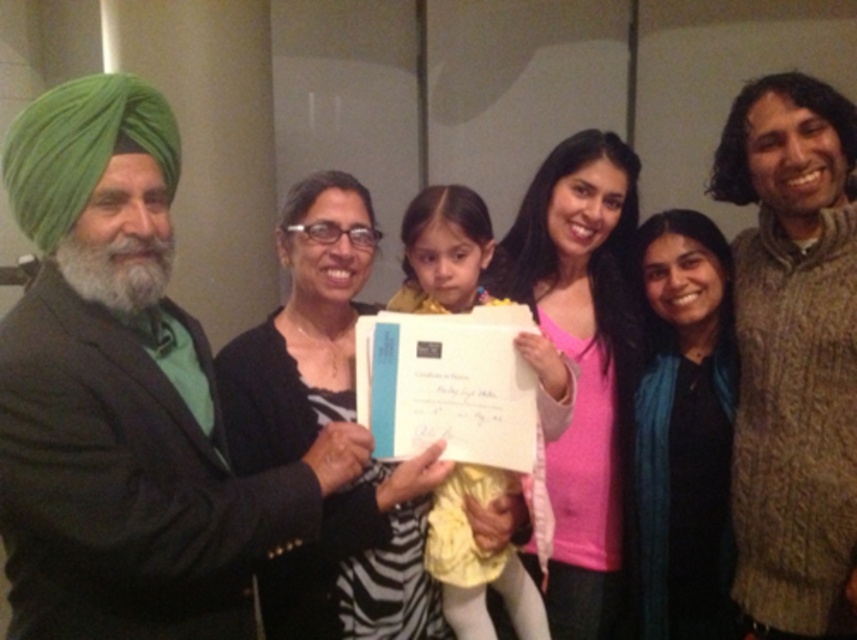
Does point (192, 531) come behind point (630, 397)?

No, (192, 531) is closer to viewer.

Does point (51, 317) come behind point (586, 189)?

No, (51, 317) is in front of (586, 189).

The image size is (857, 640). In order to click on green turban at left in this screenshot , I will do `click(124, 397)`.

Is knitted beige sweater at right shorter than black matte scarf at center?

No.

Is point (790, 458) less distant than point (672, 424)?

That is True.

The image size is (857, 640). In order to click on knitted beige sweater at right in this screenshot , I will do `click(793, 355)`.

Does black matte cardigan at center lie behind black matte scarf at center?

No, it is in front of black matte scarf at center.

Between point (309, 216) and point (658, 340), which one is positioned behind?

Point (658, 340)

At what (x,y) coordinates should I click in order to perform the action: click on black matte cardigan at center. Please return your answer as a coordinate pair (x, y). Looking at the image, I should click on (301, 328).